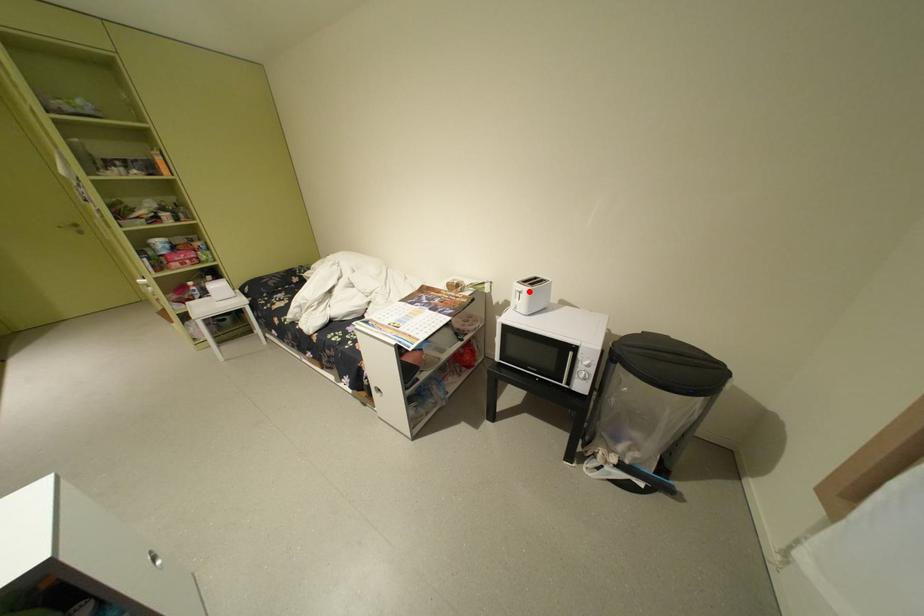
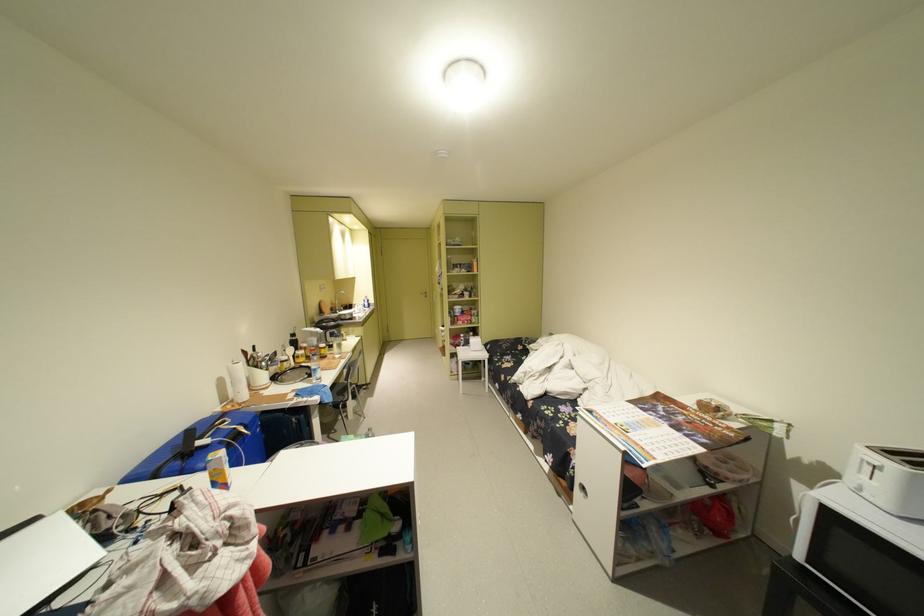
Question: I am providing you with two images of the same scene from different viewpoints. Image1 has a red point marked. In image2, the corresponding 3D location appears at what relative position? Reply with the corresponding letter.

Choices:
 (A) Closer
 (B) Farther

Answer: (A)